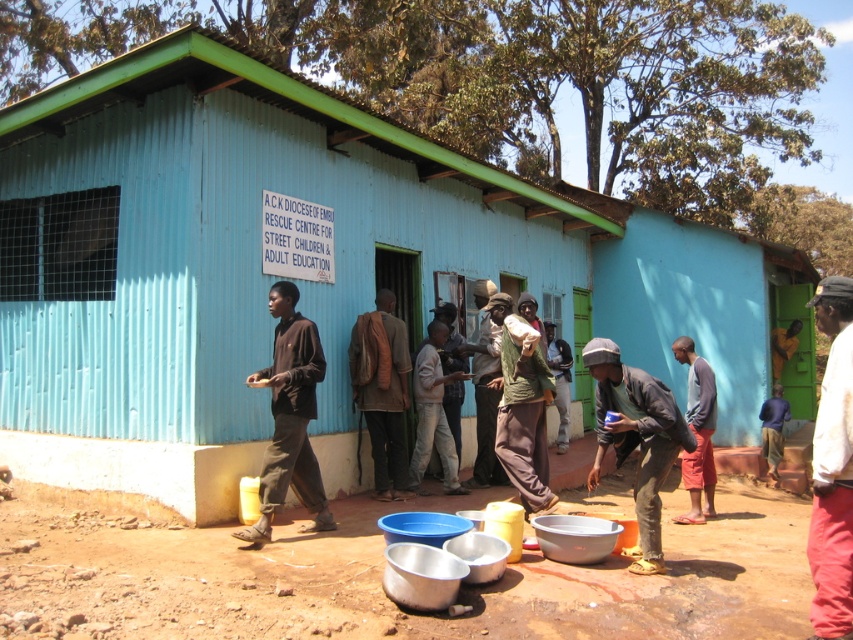
Question: Does white cotton shirt at right have a smaller size compared to dark brown fabric shirt at center?

Choices:
 (A) no
 (B) yes

Answer: (B)

Question: Can you confirm if brown dirt field at lower center is thinner than dark gray fabric jacket at lower right?

Choices:
 (A) yes
 (B) no

Answer: (A)

Question: Estimate the real-world distances between objects in this image. Which object is farther from the dark brown fabric shirt at center?

Choices:
 (A) blue cotton shirt at center
 (B) blue corrugated metal hut at center
 (C) white cotton shirt at right
 (D) dark gray fabric jacket at lower right

Answer: (A)

Question: Which point appears farthest from the camera in this image?

Choices:
 (A) (849, 346)
 (B) (331, 552)
 (C) (381, 490)
 (D) (287, 410)

Answer: (C)

Question: Observing the image, what is the correct spatial positioning of blue cotton shirt at center in reference to dark brown leather jacket at center?

Choices:
 (A) above
 (B) below

Answer: (B)

Question: Based on their relative distances, which object is nearer to the blue cotton shirt at center?

Choices:
 (A) white cotton shirt at right
 (B) dark brown leather jacket at center

Answer: (B)